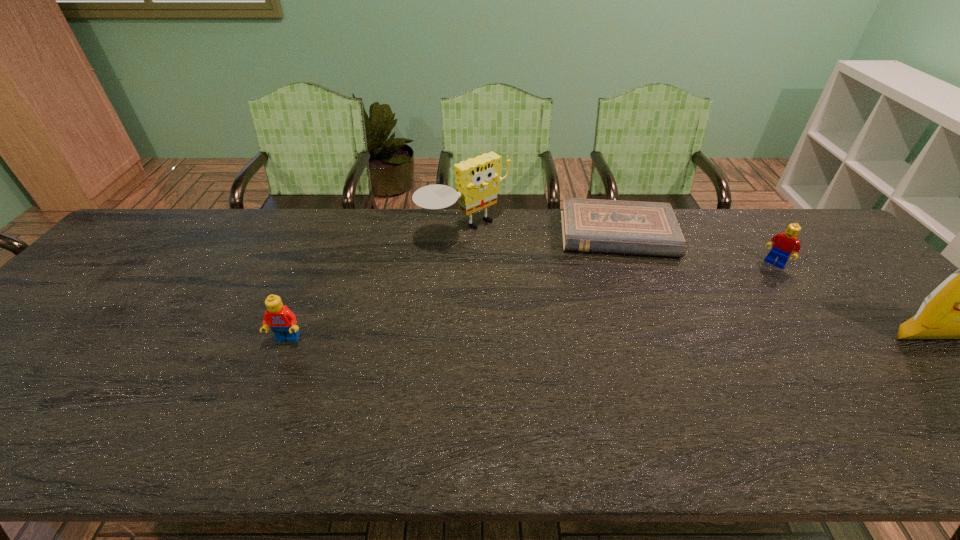
This screenshot has height=540, width=960. Identify the location of free space located 0.100m on the front-facing side of the fourth object from left to right. (756, 285).

The height and width of the screenshot is (540, 960). I want to click on free space located 0.060m on the front-facing side of the fourth object from left to right, so click(x=761, y=278).

The height and width of the screenshot is (540, 960). In order to click on vacant space located on the front-facing side of the fourth object from right to left in this screenshot , I will do `click(546, 291)`.

Identify the location of free space located on the front-facing side of the fourth object from right to left. (590, 327).

Image resolution: width=960 pixels, height=540 pixels. I want to click on free location located 0.060m on the front-facing side of the fourth object from right to left, so click(x=505, y=258).

The width and height of the screenshot is (960, 540). In order to click on vacant space situated on the spine side of the third object from right to left in this screenshot , I will do `click(626, 280)`.

Where is `vacant area located on the spine side of the third object from right to left`? The image size is (960, 540). vacant area located on the spine side of the third object from right to left is located at coordinates (629, 292).

Locate an element on the screen. Image resolution: width=960 pixels, height=540 pixels. free point located 0.380m on the spine side of the third object from right to left is located at coordinates (645, 367).

Locate an element on the screen. The image size is (960, 540). sponge present at the far edge is located at coordinates (477, 180).

In order to click on Bible present at the far edge in this screenshot , I will do `click(588, 225)`.